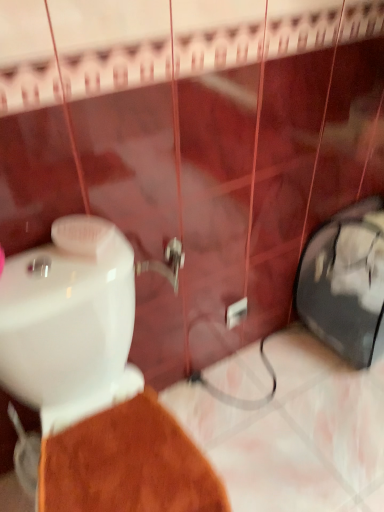
Question: Does white plastic electric outlet at center appear on the right side of white glossy toilet at lower left?

Choices:
 (A) no
 (B) yes

Answer: (B)

Question: Is white plastic electric outlet at center shorter than white glossy toilet at lower left?

Choices:
 (A) yes
 (B) no

Answer: (A)

Question: Would you say white plastic electric outlet at center is outside white glossy toilet at lower left?

Choices:
 (A) yes
 (B) no

Answer: (A)

Question: Considering the relative sizes of white plastic electric outlet at center and white glossy toilet at lower left in the image provided, is white plastic electric outlet at center bigger than white glossy toilet at lower left?

Choices:
 (A) no
 (B) yes

Answer: (A)

Question: Is there a large distance between white plastic electric outlet at center and white glossy toilet at lower left?

Choices:
 (A) no
 (B) yes

Answer: (A)

Question: Considering the relative sizes of white plastic electric outlet at center and white glossy toilet at lower left in the image provided, is white plastic electric outlet at center wider than white glossy toilet at lower left?

Choices:
 (A) no
 (B) yes

Answer: (A)

Question: From a real-world perspective, is white glossy toilet at lower left located higher than white plastic electric outlet at center?

Choices:
 (A) yes
 (B) no

Answer: (A)

Question: Can white plastic electric outlet at center be found inside white glossy toilet at lower left?

Choices:
 (A) yes
 (B) no

Answer: (B)

Question: Is the depth of white glossy toilet at lower left greater than that of white plastic electric outlet at center?

Choices:
 (A) yes
 (B) no

Answer: (B)

Question: Is white glossy toilet at lower left at the right side of white plastic electric outlet at center?

Choices:
 (A) no
 (B) yes

Answer: (A)

Question: Is white glossy toilet at lower left bigger than white plastic electric outlet at center?

Choices:
 (A) yes
 (B) no

Answer: (A)

Question: Is white glossy toilet at lower left positioned far away from white plastic electric outlet at center?

Choices:
 (A) no
 (B) yes

Answer: (A)

Question: From the image's perspective, is white plastic electric outlet at center above or below white glossy toilet at lower left?

Choices:
 (A) below
 (B) above

Answer: (B)